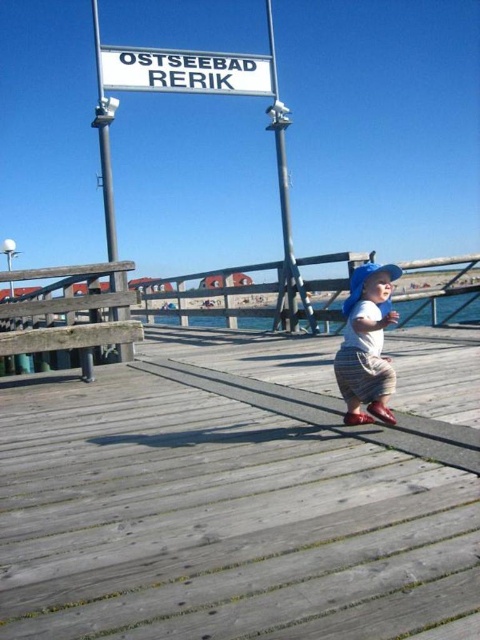
Between matte blue hat at center and metallic gray pole at upper center, which one is positioned higher?

metallic gray pole at upper center is above.

Where is `matte blue hat at center`? matte blue hat at center is located at coordinates (367, 344).

Between white plastic sign at upper center and metallic gray pole at upper center, which one appears on the right side from the viewer's perspective?

metallic gray pole at upper center is more to the right.

Is white plastic sign at upper center smaller than metallic gray pole at upper center?

Yes, white plastic sign at upper center is smaller than metallic gray pole at upper center.

The height and width of the screenshot is (640, 480). Identify the location of white plastic sign at upper center. (184, 72).

I want to click on white plastic sign at upper center, so click(184, 72).

Who is taller, gray wooden dock at center or metallic pole at upper center?

With more height is metallic pole at upper center.

Describe the element at coordinates (241, 496) in the screenshot. I see `gray wooden dock at center` at that location.

Between point (295, 374) and point (106, 108), which one is positioned in front?

Point (295, 374) is in front.

Image resolution: width=480 pixels, height=640 pixels. Identify the location of gray wooden dock at center. (241, 496).